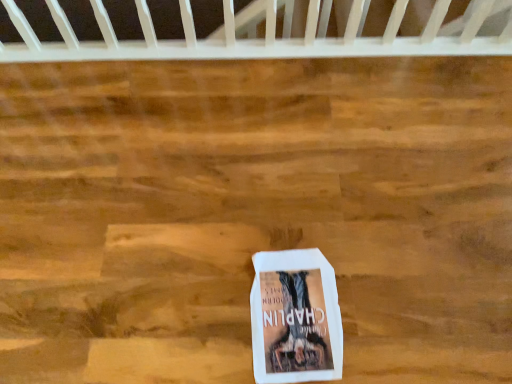
Describe the element at coordinates (254, 40) in the screenshot. The height and width of the screenshot is (384, 512). I see `white plastic crib at upper center` at that location.

The width and height of the screenshot is (512, 384). Identify the location of white plastic crib at upper center. (254, 40).

Looking at this image, in order to face white plastic crib at upper center, should I rotate leftwards or rightwards?

A 0.484 degree turn to the left will do.

Describe the element at coordinates (295, 318) in the screenshot. Image resolution: width=512 pixels, height=384 pixels. I see `white paper book at center` at that location.

Locate an element on the screen. The image size is (512, 384). white paper book at center is located at coordinates (295, 318).

Image resolution: width=512 pixels, height=384 pixels. I want to click on white plastic crib at upper center, so click(x=254, y=40).

Which object is positioned more to the left, white plastic crib at upper center or white paper book at center?

white plastic crib at upper center is more to the left.

Based on the photo, is white plastic crib at upper center in front of white paper book at center?

No.

Is point (459, 53) positioned before point (307, 278)?

No, it is not.

From the image's perspective, does white plastic crib at upper center appear lower than white paper book at center?

No, from the image's perspective, white plastic crib at upper center is not beneath white paper book at center.

From a real-world perspective, is white plastic crib at upper center under white paper book at center?

No.

Considering the relative sizes of white plastic crib at upper center and white paper book at center in the image provided, is white plastic crib at upper center thinner than white paper book at center?

Indeed, white plastic crib at upper center has a lesser width compared to white paper book at center.

Can you confirm if white plastic crib at upper center is shorter than white paper book at center?

Incorrect, the height of white plastic crib at upper center does not fall short of that of white paper book at center.

Who is bigger, white plastic crib at upper center or white paper book at center?

Bigger between the two is white plastic crib at upper center.

Is white plastic crib at upper center inside the boundaries of white paper book at center, or outside?

white plastic crib at upper center is located beyond the bounds of white paper book at center.

Looking at this image, are white plastic crib at upper center and white paper book at center making contact?

white plastic crib at upper center and white paper book at center are not in contact.

Is white plastic crib at upper center looking in the opposite direction of white paper book at center?

No, white paper book at center is not at the back of white plastic crib at upper center.

Measure the distance between white plastic crib at upper center and white paper book at center.

white plastic crib at upper center and white paper book at center are 32.22 inches apart from each other.

This screenshot has width=512, height=384. Find the location of `book in front of the white plastic crib at upper center`. book in front of the white plastic crib at upper center is located at coordinates (295, 318).

Is white paper book at center at the left side of white plastic crib at upper center?

Incorrect, white paper book at center is not on the left side of white plastic crib at upper center.

Which object is closer to the camera, white paper book at center or white plastic crib at upper center?

white paper book at center is closer to the camera.

Which is in front, point (333, 311) or point (227, 3)?

The point (333, 311) is in front.

From the image's perspective, is white paper book at center under white plastic crib at upper center?

Yes.

From a real-world perspective, between white paper book at center and white plastic crib at upper center, who is vertically lower?

white paper book at center, from a real-world perspective.

Which object is wider, white paper book at center or white plastic crib at upper center?

white paper book at center.

In terms of height, does white paper book at center look taller or shorter compared to white plastic crib at upper center?

white paper book at center is shorter than white plastic crib at upper center.

Is white paper book at center bigger than white plastic crib at upper center?

No, white paper book at center is not bigger than white plastic crib at upper center.

Is white paper book at center not inside white plastic crib at upper center?

That's correct, white paper book at center is outside of white plastic crib at upper center.

Is white paper book at center positioned far away from white plastic crib at upper center?

Actually, white paper book at center and white plastic crib at upper center are a little close together.

Could you tell me if white paper book at center is turned towards white plastic crib at upper center?

No, white paper book at center does not turn towards white plastic crib at upper center.

How far apart are white paper book at center and white plastic crib at upper center?

white paper book at center is 32.22 inches away from white plastic crib at upper center.

There is a white paper book at center. Where is `infant bed above it (from a real-world perspective)`? infant bed above it (from a real-world perspective) is located at coordinates (254, 40).

Locate an element on the screen. The height and width of the screenshot is (384, 512). infant bed lying above the white paper book at center (from the image's perspective) is located at coordinates (254, 40).

At what (x,y) coordinates should I click in order to perform the action: click on infant bed behind the white paper book at center. Please return your answer as a coordinate pair (x, y). The image size is (512, 384). Looking at the image, I should click on (254, 40).